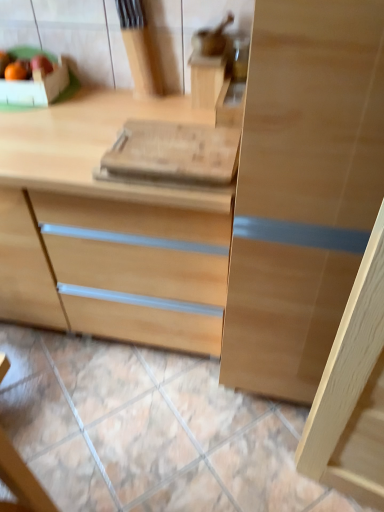
Question: Can you confirm if natural stone tile at lower center is smaller than matte wooden apple at upper left?

Choices:
 (A) yes
 (B) no

Answer: (B)

Question: From a real-world perspective, is natural stone tile at lower center positioned over matte wooden apple at upper left based on gravity?

Choices:
 (A) yes
 (B) no

Answer: (B)

Question: Considering the relative positions of natural stone tile at lower center and matte wooden apple at upper left in the image provided, is natural stone tile at lower center behind matte wooden apple at upper left?

Choices:
 (A) yes
 (B) no

Answer: (B)

Question: Is natural stone tile at lower center to the right of matte wooden apple at upper left from the viewer's perspective?

Choices:
 (A) yes
 (B) no

Answer: (A)

Question: Is natural stone tile at lower center at the left side of matte wooden apple at upper left?

Choices:
 (A) yes
 (B) no

Answer: (B)

Question: From the image's perspective, is natural wood chest of drawers at center located above or below natural stone tile at lower center?

Choices:
 (A) above
 (B) below

Answer: (A)

Question: Does point (183, 101) appear closer or farther from the camera than point (77, 348)?

Choices:
 (A) farther
 (B) closer

Answer: (B)

Question: Would you say natural wood chest of drawers at center is to the left or to the right of natural stone tile at lower center in the picture?

Choices:
 (A) right
 (B) left

Answer: (B)

Question: Choose the correct answer: Is natural wood chest of drawers at center inside natural stone tile at lower center or outside it?

Choices:
 (A) outside
 (B) inside

Answer: (A)

Question: Would you say natural stone tile at lower center is inside or outside matte wooden apple at upper left?

Choices:
 (A) outside
 (B) inside

Answer: (A)

Question: From a real-world perspective, relative to matte wooden apple at upper left, is natural stone tile at lower center vertically above or below?

Choices:
 (A) above
 (B) below

Answer: (B)

Question: In terms of width, does natural stone tile at lower center look wider or thinner when compared to matte wooden apple at upper left?

Choices:
 (A) thin
 (B) wide

Answer: (B)

Question: Based on their sizes in the image, would you say natural stone tile at lower center is bigger or smaller than matte wooden apple at upper left?

Choices:
 (A) big
 (B) small

Answer: (A)

Question: Relative to natural wood chest of drawers at center, is matte wooden apple at upper left in front or behind?

Choices:
 (A) behind
 (B) front

Answer: (A)

Question: From the image's perspective, is matte wooden apple at upper left above or below natural wood chest of drawers at center?

Choices:
 (A) above
 (B) below

Answer: (A)